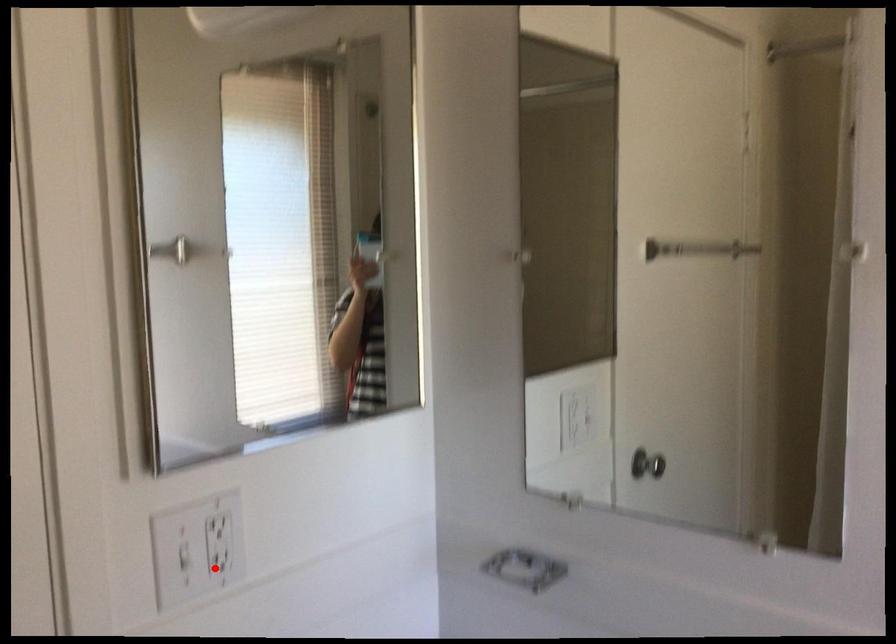
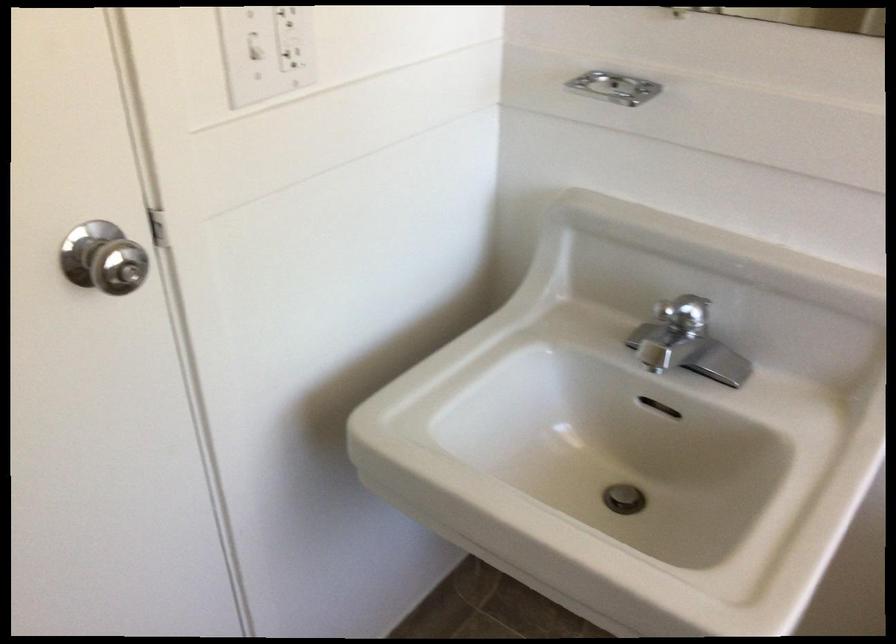
Find the pixel in the second image that matches the highlighted location in the first image.

(291, 59)